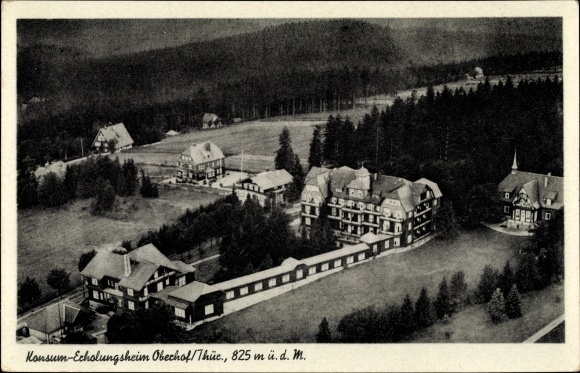
At what (x,y) coordinates should I click in order to perform the action: click on door. Please return your answer as a coordinate pair (x, y). The width and height of the screenshot is (580, 373). Looking at the image, I should click on (522, 215).